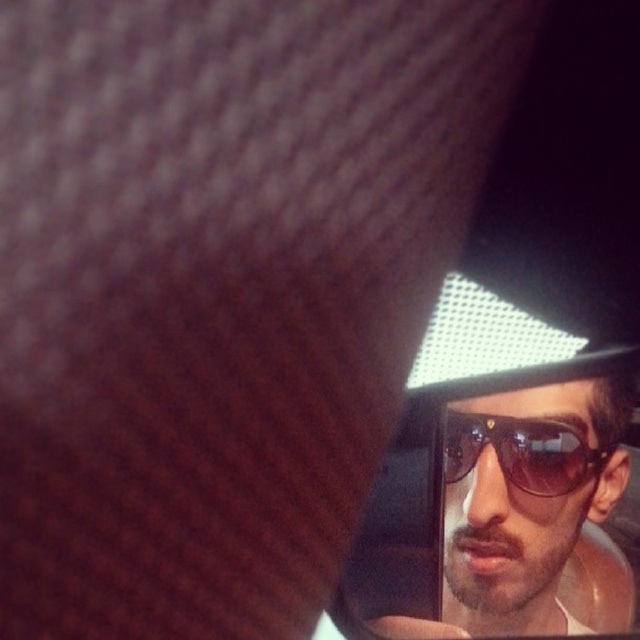
Is sunglasses at upper right to the right of sunglasses at right from the viewer's perspective?

Correct, you'll find sunglasses at upper right to the right of sunglasses at right.

Is sunglasses at upper right behind sunglasses at right?

No.

Find the location of a particular element. The height and width of the screenshot is (640, 640). sunglasses at upper right is located at coordinates (525, 499).